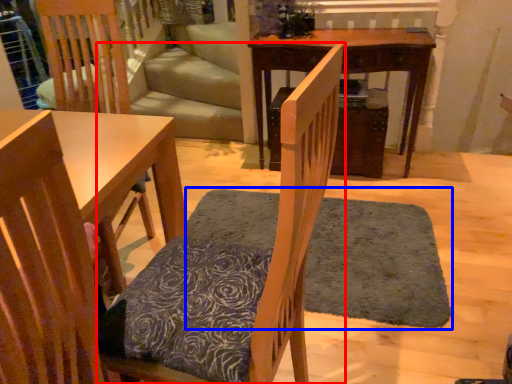
Question: Among these objects, which one is farthest to the camera, chair (highlighted by a red box) or doormat (highlighted by a blue box)?

Choices:
 (A) chair
 (B) doormat

Answer: (B)